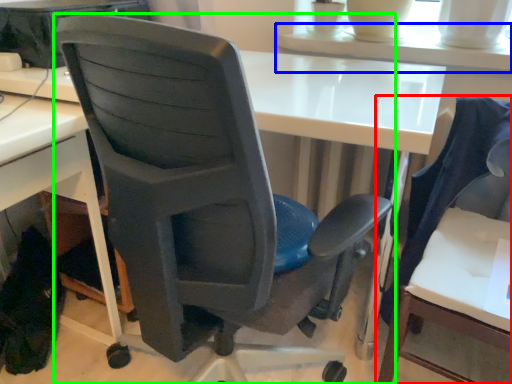
Question: Which object is the farthest from chair (highlighted by a red box)? Choose among these: table (highlighted by a blue box) or chair (highlighted by a green box).

Choices:
 (A) table
 (B) chair

Answer: (B)